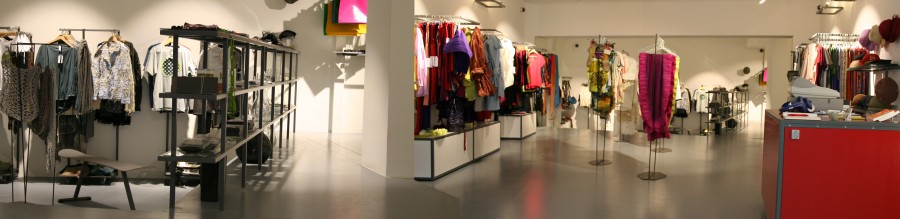
At what (x,y) coordinates should I click in order to perform the action: click on hangers. Please return your answer as a coordinate pair (x, y). The image size is (900, 219). Looking at the image, I should click on (61, 36), (113, 38).